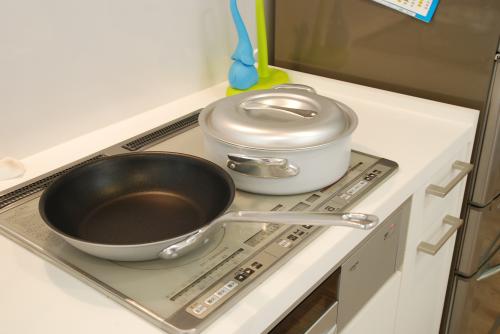
The width and height of the screenshot is (500, 334). I want to click on white counter top, so click(x=408, y=128), click(x=45, y=307), click(x=91, y=137).